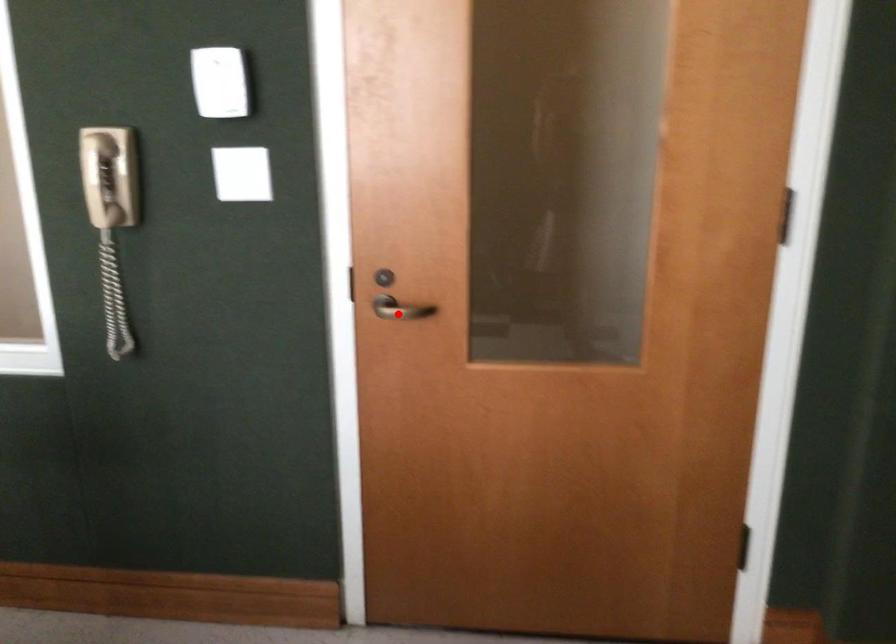
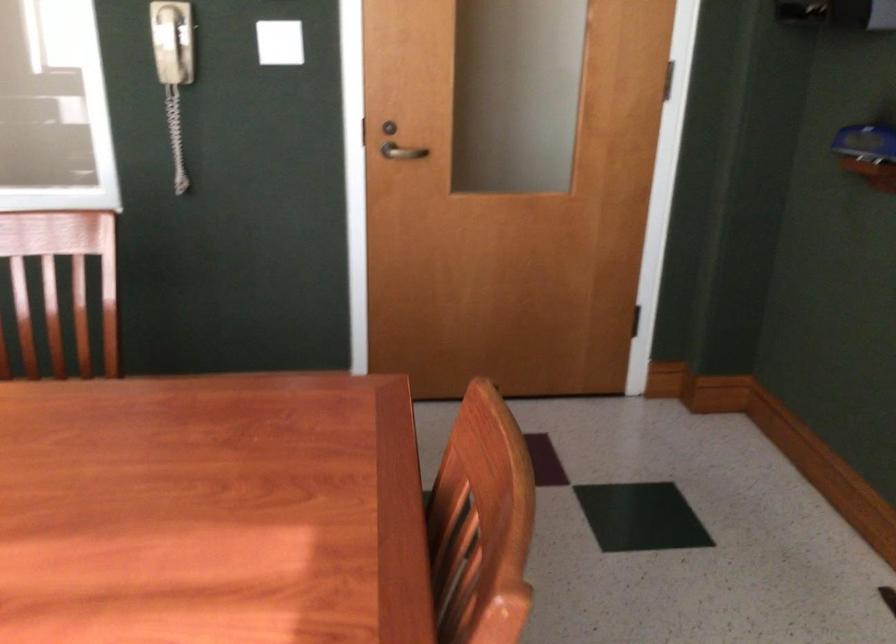
Question: I am providing you with two images of the same scene from different viewpoints. Image1 has a red point marked. In image2, the corresponding 3D location appears at what relative position? Reply with the corresponding letter.

Choices:
 (A) Closer
 (B) Farther

Answer: (B)